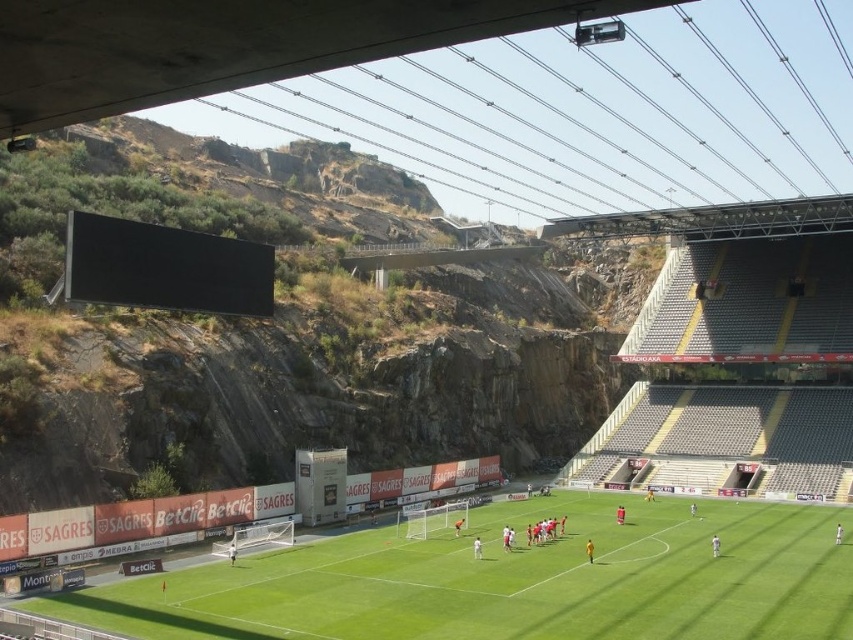
Is the position of green grass football field at center more distant than that of white matte soccer goal at center?

No, it is not.

Can you confirm if green grass football field at center is positioned to the right of white matte soccer goal at center?

Yes, green grass football field at center is to the right of white matte soccer goal at center.

Is point (511, 552) farther from viewer compared to point (450, 518)?

No, (511, 552) is in front of (450, 518).

The width and height of the screenshot is (853, 640). In order to click on green grass football field at center in this screenshot , I will do [515, 580].

Does white matte soccer goal at lower center have a lesser height compared to white matte soccer goal at center?

Indeed, white matte soccer goal at lower center has a lesser height compared to white matte soccer goal at center.

Who is lower down, white matte soccer goal at lower center or white matte soccer goal at center?

Positioned lower is white matte soccer goal at center.

Does point (271, 540) come closer to viewer compared to point (467, 512)?

Yes, it is in front of point (467, 512).

The width and height of the screenshot is (853, 640). I want to click on white matte soccer goal at lower center, so click(257, 536).

Which is above, green grass football field at center or white matte soccer goal at lower center?

Positioned higher is white matte soccer goal at lower center.

Based on the photo, is green grass football field at center closer to camera compared to white matte soccer goal at lower center?

Yes.

Is point (750, 545) farther from camera compared to point (235, 552)?

That is True.

This screenshot has height=640, width=853. I want to click on green grass football field at center, so click(515, 580).